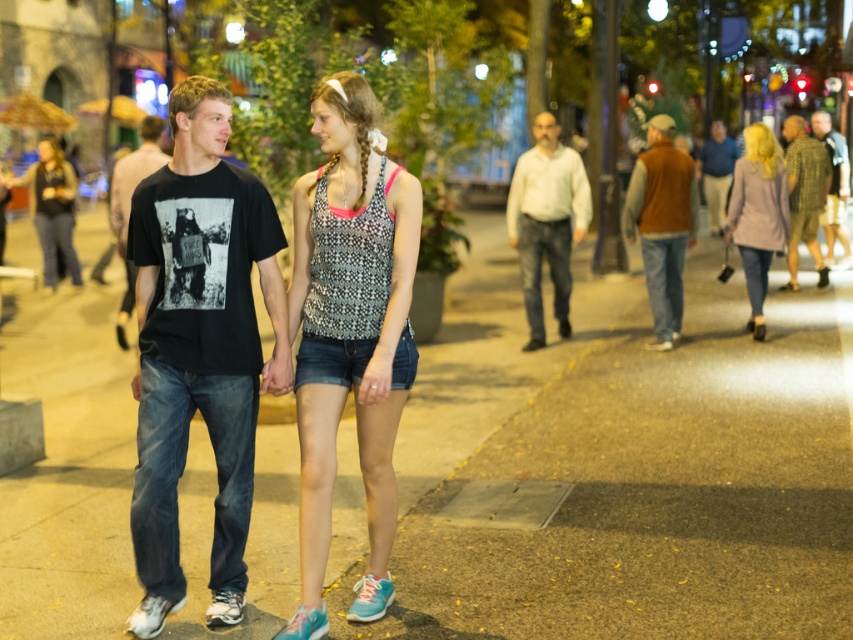
Is point (537, 262) more distant than point (757, 236)?

No, it is not.

Does white cotton shirt at center appear under light gray wool coat at right?

Indeed, white cotton shirt at center is positioned under light gray wool coat at right.

Where is `white cotton shirt at center`? This screenshot has width=853, height=640. white cotton shirt at center is located at coordinates (546, 220).

Is point (589, 218) behind point (796, 189)?

No, (589, 218) is closer to viewer.

Between point (543, 129) and point (824, 272), which one is positioned in front?

Point (543, 129) is more forward.

Which is in front, point (532, 250) or point (817, 205)?

Point (532, 250) is more forward.

Find the location of `white cotton shirt at center`. white cotton shirt at center is located at coordinates (546, 220).

Is point (825, 188) farther from viewer compared to point (839, 214)?

No.

In the scene shown: Is patterned fabric shirt at right further to the viewer compared to brown leather jacket at right?

No, it is not.

Find the location of `patterned fabric shirt at right`. patterned fabric shirt at right is located at coordinates (804, 195).

Locate an element on the screen. This screenshot has height=640, width=853. patterned fabric shirt at right is located at coordinates (804, 195).